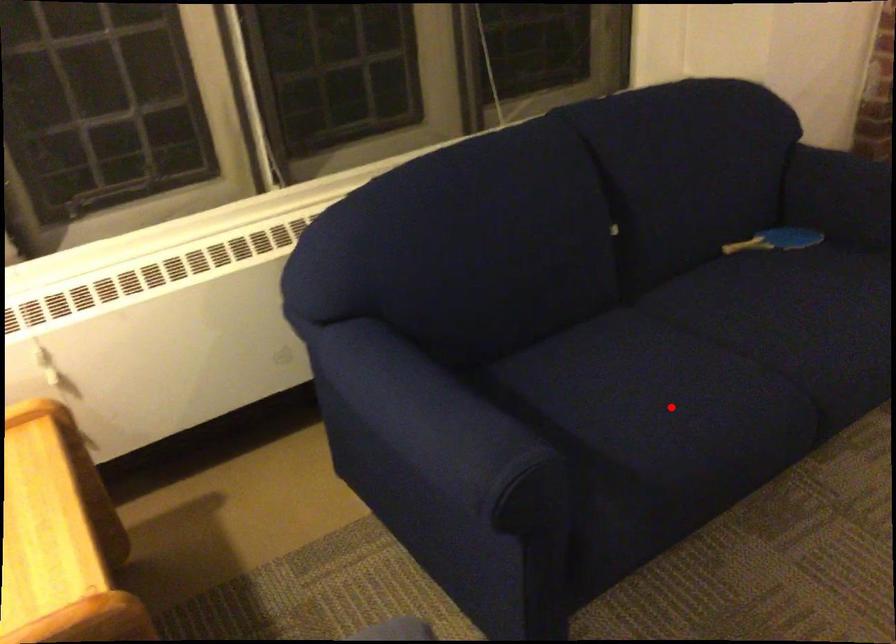
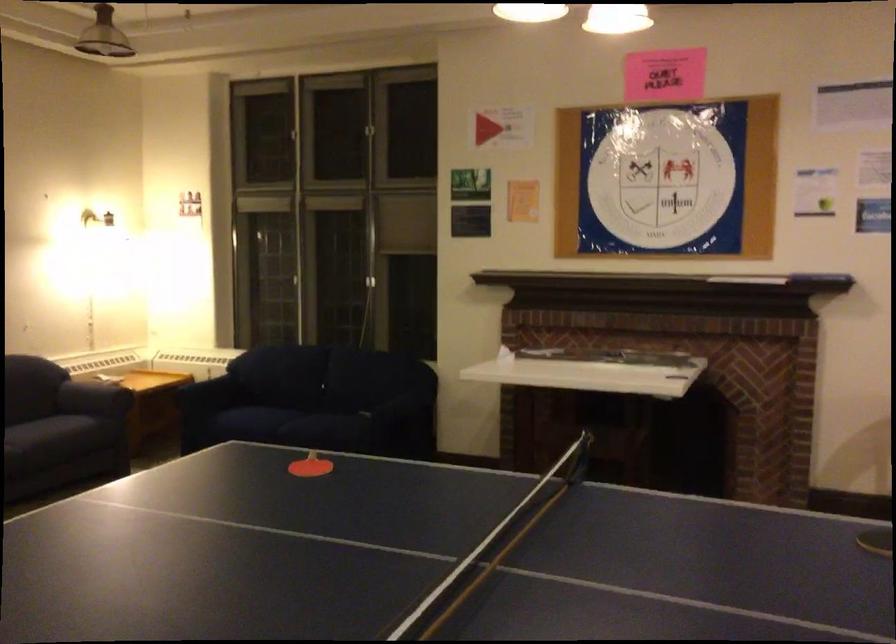
In the second image, find the point that corresponds to the highlighted location in the first image.

(271, 424)